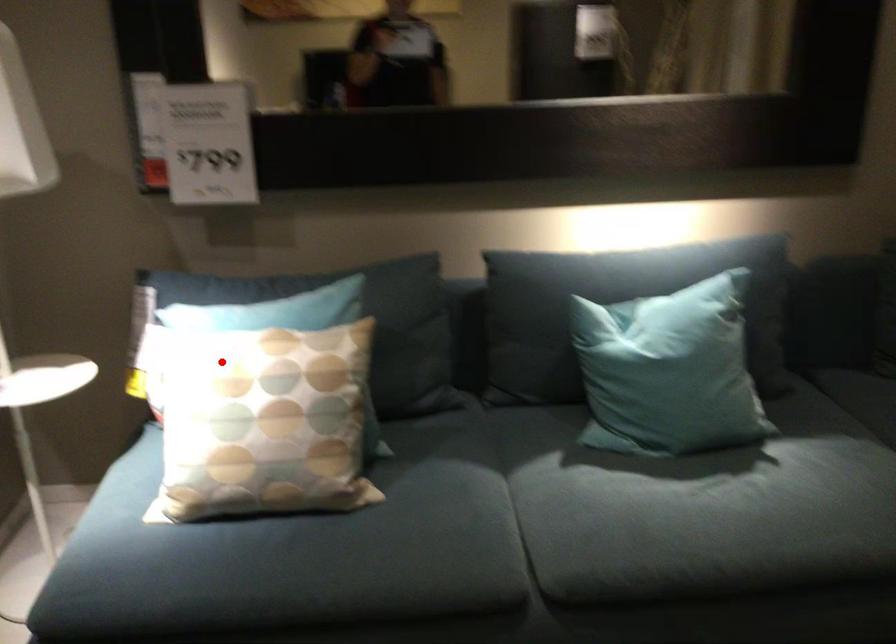
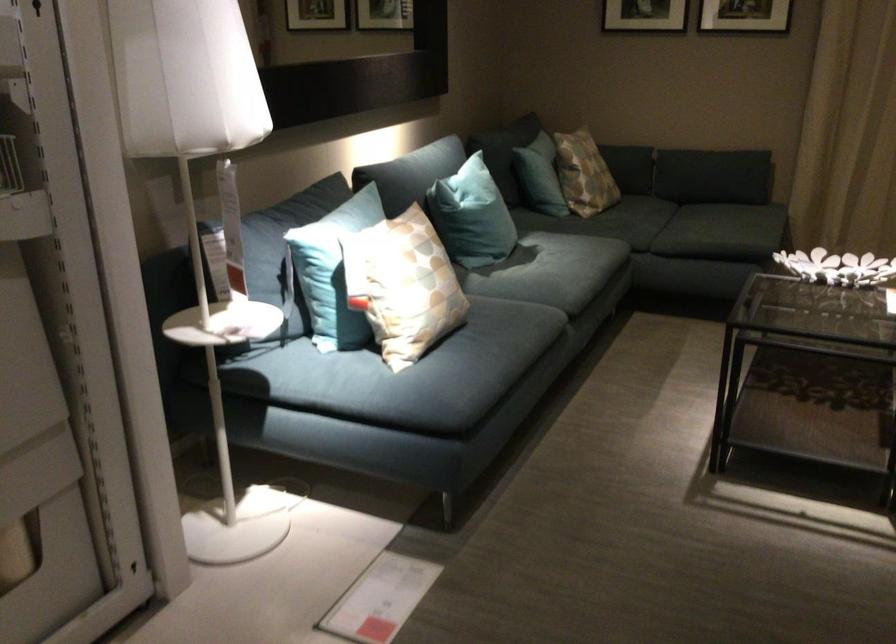
Question: I am providing you with two images of the same scene from different viewpoints. In image1, a red point is highlighted. Considering the same 3D point in image2, which of the following is correct?

Choices:
 (A) It is closer
 (B) It is farther

Answer: (B)